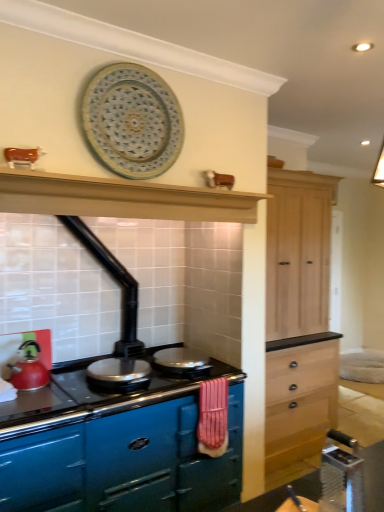
Question: Is matte red kettle at left in front of or behind blue ceramic platter at upper center in the image?

Choices:
 (A) front
 (B) behind

Answer: (B)

Question: In the image, is matte red kettle at left on the left side or the right side of blue ceramic platter at upper center?

Choices:
 (A) right
 (B) left

Answer: (B)

Question: Which is farther from the glossy enamel stove at center?

Choices:
 (A) matte black exhaust hood at upper center
 (B) metallic silver table at lower right
 (C) blue ceramic platter at upper center
 (D) shiny silver pan at center, the 2th appliance when ordered from left to right
 (E) shiny metallic pan at center, which is the 2th appliance in right-to-left order

Answer: (C)

Question: Which is nearer to the metallic silver table at lower right?

Choices:
 (A) matte red kettle at left
 (B) matte black exhaust hood at upper center
 (C) glossy enamel stove at center
 (D) blue ceramic platter at upper center
 (E) shiny silver pan at center, the 2th appliance when ordered from left to right

Answer: (C)